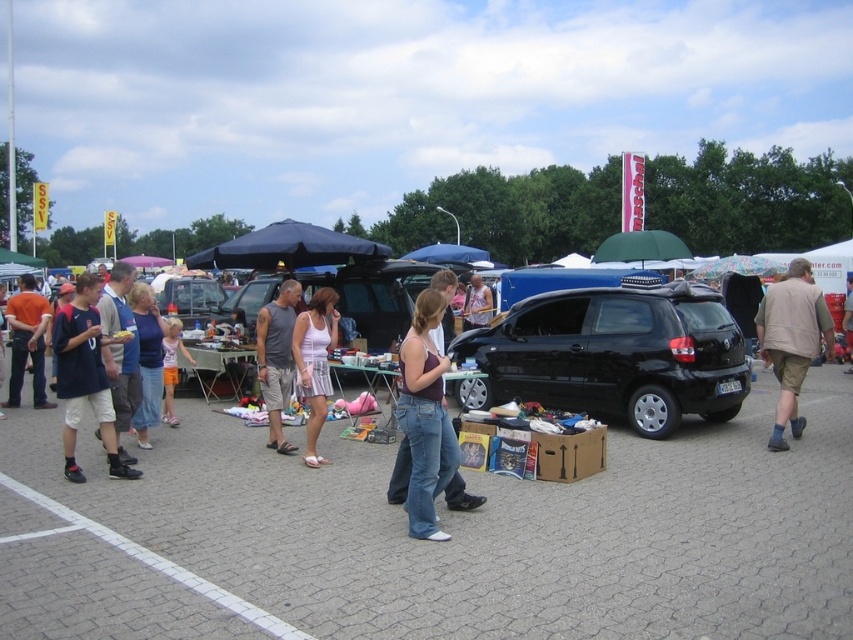
You are a delivery person who needs to park your black matte hatchback at center in a parking space marked by white lines. The parking space is exactly the same size as the white fabric dress at center. Will your car fit in the space?

The black matte hatchback at center is bigger than the white fabric dress at center, so the car will not fit in the parking space which is the same size as the dress.